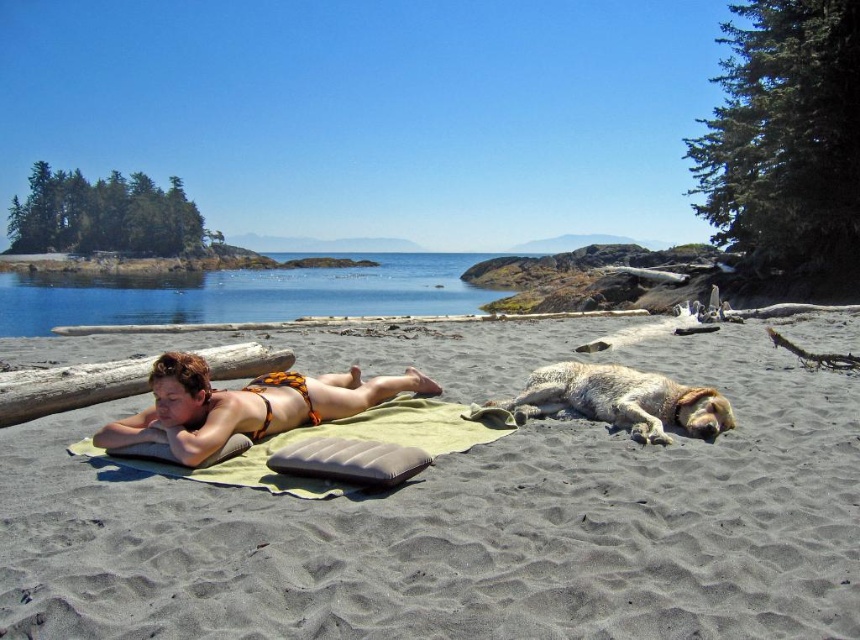
Based on the photo, you are standing on the beach and want to find the dark brown sand at center. Which direction should you walk from your current position at point [467,531]?

The point [467,531] is already at the dark brown sand at center, so you are already standing on it.

You are planning to build a sandcastle on the beach. Given the dark brown sand at center and the clear blue water at center, which area would be more suitable for building a sandcastle based on their widths?

The clear blue water at center is wider than the dark brown sand at center. Therefore, the dark brown sand at center is narrower and less suitable for building a sandcastle since sandcastles require a stable and wider area of sand.